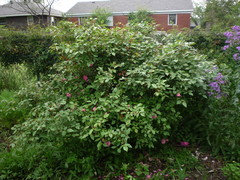
You are a GUI agent. You are given a task and a screenshot of the screen. Output one action in this format:
    pyautogui.click(x=<x>, y=<y>)
    Task: Click on the windows
    This screenshot has height=180, width=240.
    Given the screenshot: What is the action you would take?
    pyautogui.click(x=171, y=18), pyautogui.click(x=109, y=19), pyautogui.click(x=53, y=20), pyautogui.click(x=30, y=19), pyautogui.click(x=3, y=21)